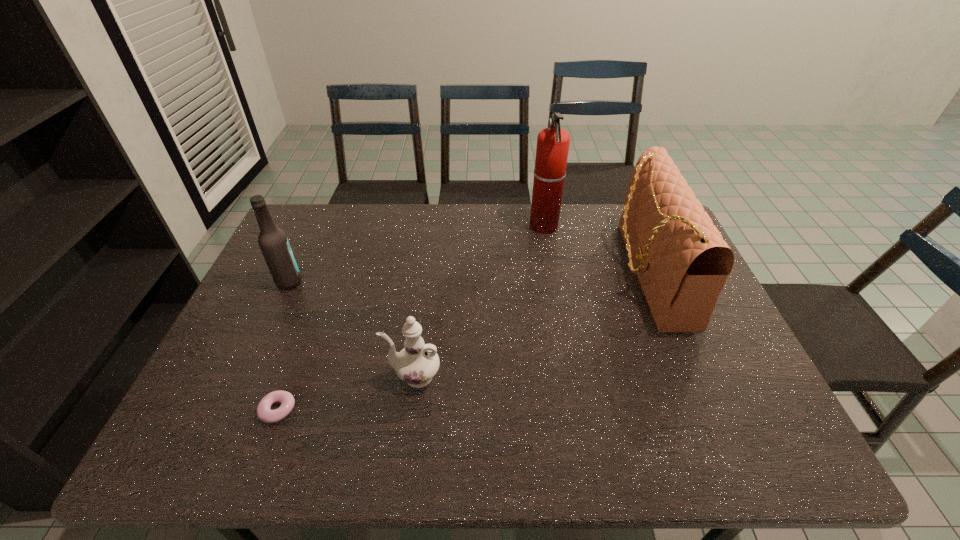
Locate an element on the screen. vacant space located 0.240m with the nozzle and gauge on the tallest object is located at coordinates (459, 227).

Where is `vacant area located on the front-facing side of the handbag`? vacant area located on the front-facing side of the handbag is located at coordinates (585, 273).

Identify the location of free space located 0.160m on the front-facing side of the handbag. Image resolution: width=960 pixels, height=540 pixels. (568, 273).

Identify the location of vacant space located 0.200m on the front-facing side of the handbag. (555, 273).

This screenshot has height=540, width=960. What are the coordinates of `free spot located 0.180m on the label of the leftmost object` in the screenshot? It's located at (363, 282).

I want to click on vacant space located at the spout of the chinaware, so click(266, 376).

Identify the location of blank area located at the spout of the chinaware. (287, 376).

This screenshot has width=960, height=540. In order to click on free region located at the spout of the chinaware in this screenshot , I will do `click(266, 376)`.

Identify the location of vacant position located on the front of the second object from left to right. The height and width of the screenshot is (540, 960). (262, 453).

The image size is (960, 540). Identify the location of fire extinguisher that is positioned at the far edge. (553, 143).